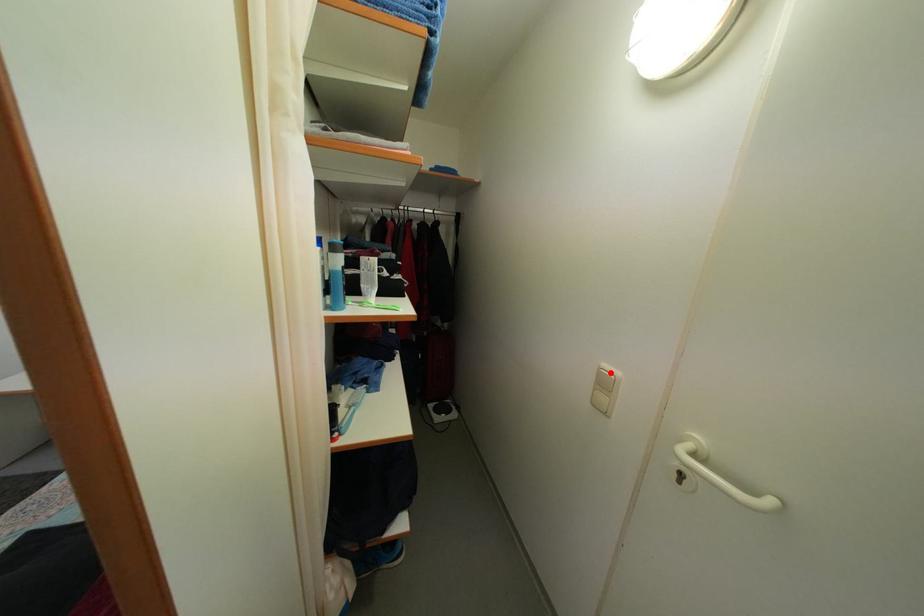
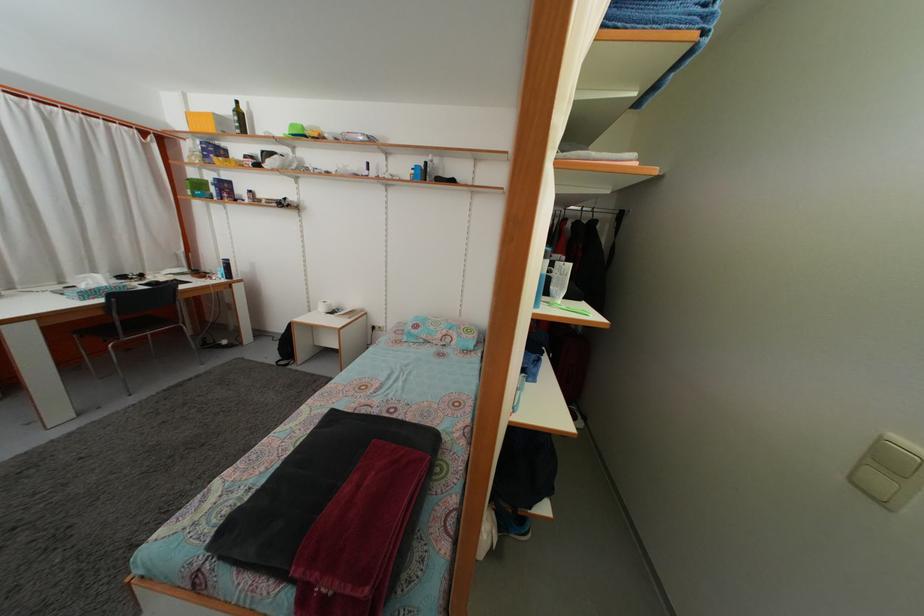
Locate, in the second image, the point that corresponds to the highlighted location in the first image.

(903, 445)